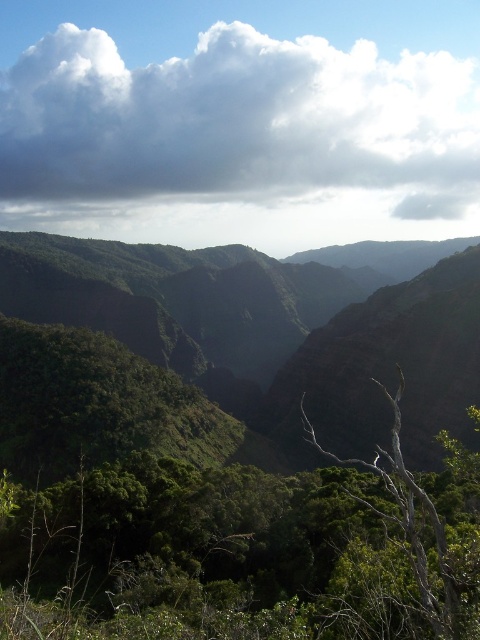
Is white fluffy cloud at upper center further to the viewer compared to gray bark tree at center?

Yes, it is behind gray bark tree at center.

Is point (45, 148) behind point (395, 497)?

Yes, it is.

This screenshot has height=640, width=480. What are the coordinates of `white fluffy cloud at upper center` in the screenshot? It's located at (237, 124).